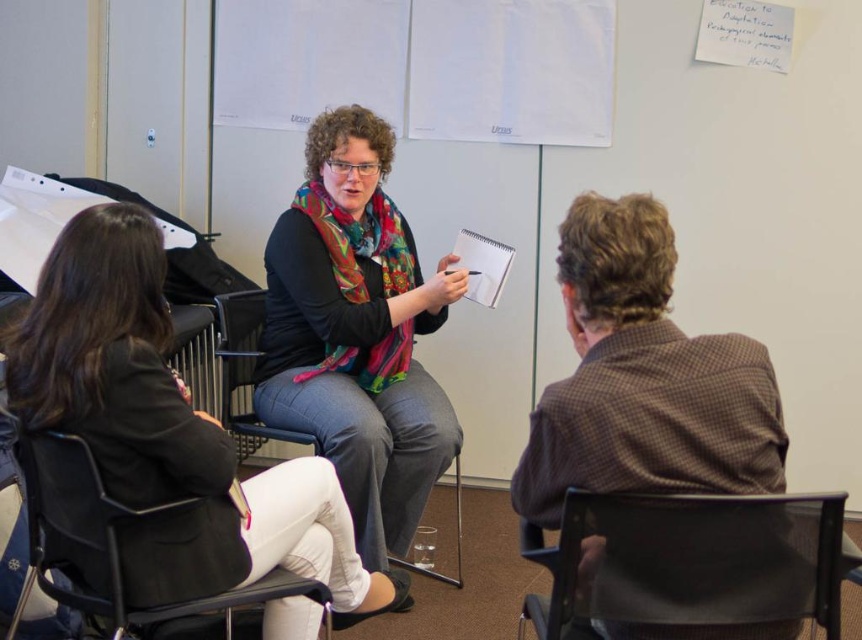
Question: Which of these objects is positioned farthest from the multicolored scarf at center?

Choices:
 (A) black matte scarf at center
 (B) black mesh chair at lower left
 (C) black mesh chair at center
 (D) black mesh chair at lower right

Answer: (D)

Question: Can you confirm if black matte scarf at center is bigger than black mesh chair at center?

Choices:
 (A) yes
 (B) no

Answer: (B)

Question: Is black matte scarf at center positioned at the back of black mesh chair at lower left?

Choices:
 (A) no
 (B) yes

Answer: (B)

Question: Among these points, which one is nearest to the camera?

Choices:
 (A) (63, 474)
 (B) (584, 486)
 (C) (250, 356)
 (D) (378, 337)

Answer: (B)

Question: Does black matte scarf at center appear on the left side of black mesh chair at center?

Choices:
 (A) no
 (B) yes

Answer: (A)

Question: Which point is closer to the camera?

Choices:
 (A) multicolored scarf at center
 (B) black mesh chair at lower left
 (C) brown checkered shirt at right
 (D) black matte scarf at center

Answer: (C)